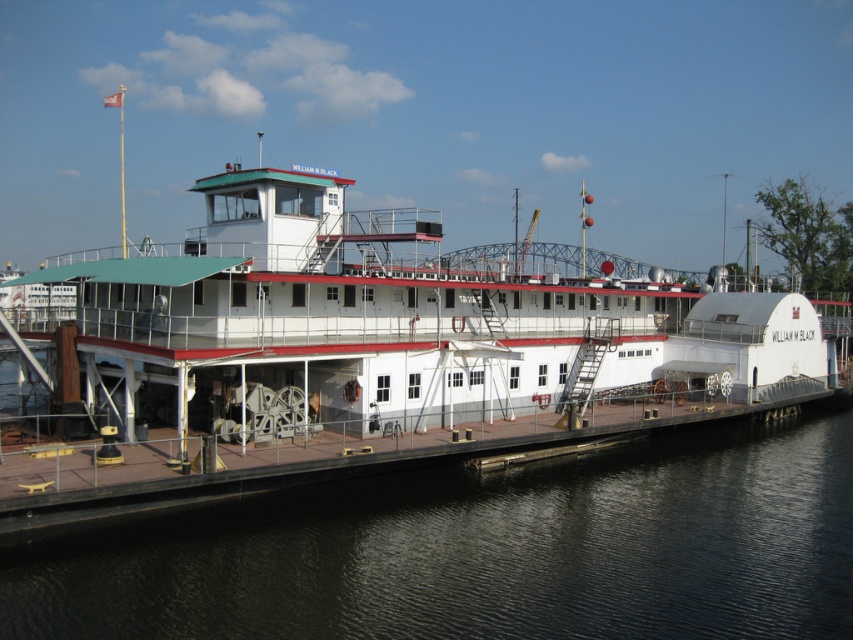
Which of these two, white matte boat at center or black water at lower left, stands taller?

white matte boat at center

Find the location of a particular element. Image resolution: width=853 pixels, height=640 pixels. white matte boat at center is located at coordinates (374, 324).